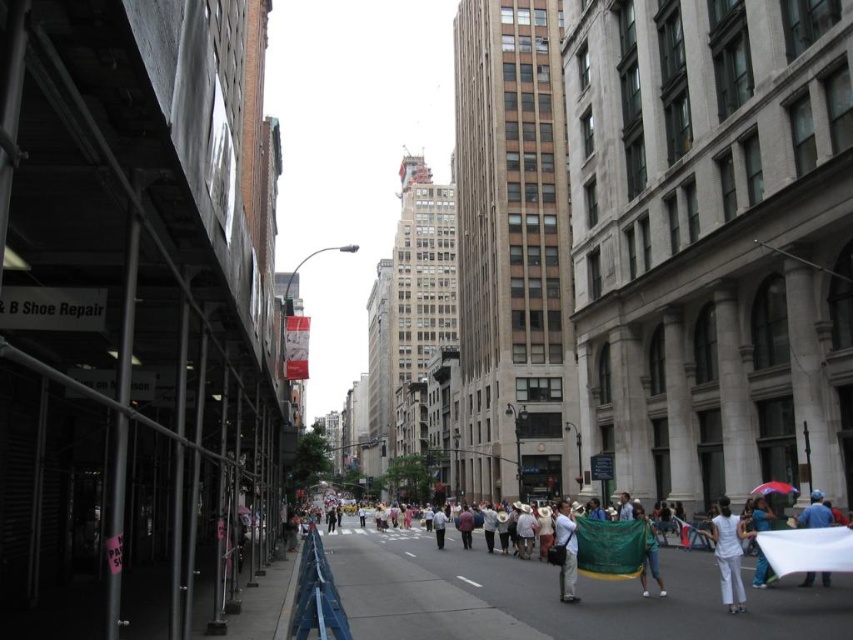
Is denim pants at lower right to the right of white matte umbrella at lower right from the viewer's perspective?

In fact, denim pants at lower right is to the left of white matte umbrella at lower right.

Is point (651, 566) farther from camera compared to point (764, 586)?

Yes, point (651, 566) is farther from viewer.

Find the location of a particular element. Image resolution: width=853 pixels, height=640 pixels. denim pants at lower right is located at coordinates (648, 552).

Which is above, white cotton shirt at center or denim pants at lower right?

Positioned higher is denim pants at lower right.

Is white cotton shirt at center positioned at the back of denim pants at lower right?

Yes, it is behind denim pants at lower right.

At what (x,y) coordinates should I click in order to perform the action: click on white cotton shirt at center. Please return your answer as a coordinate pair (x, y). This screenshot has height=640, width=853. Looking at the image, I should click on (566, 552).

At what (x,y) coordinates should I click in order to perform the action: click on white cotton shirt at center. Please return your answer as a coordinate pair (x, y). This screenshot has width=853, height=640. Looking at the image, I should click on (566, 552).

Is concrete sidewalk at center wider than blue fabric at center?

Correct, the width of concrete sidewalk at center exceeds that of blue fabric at center.

Looking at this image, is concrete sidewalk at center in front of blue fabric at center?

Yes, it is in front of blue fabric at center.

Which is behind, point (672, 572) or point (811, 573)?

The point (672, 572) is more distant.

Locate an element on the screen. This screenshot has width=853, height=640. concrete sidewalk at center is located at coordinates (555, 596).